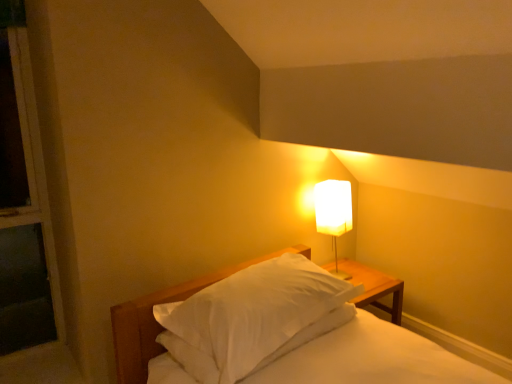
The width and height of the screenshot is (512, 384). In order to click on empty space that is ontop of white fabric lampshade at upper right (from a real-world perspective) in this screenshot , I will do `click(334, 185)`.